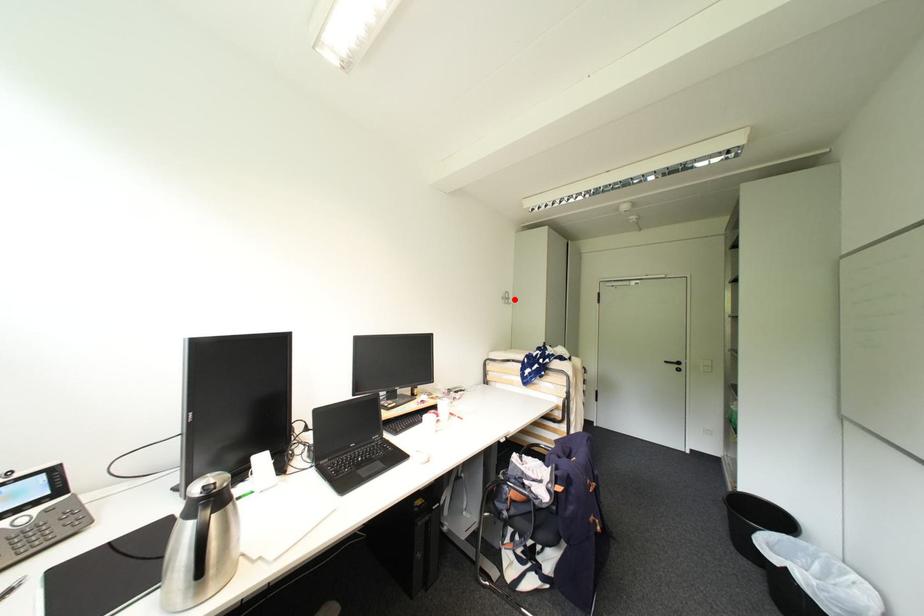
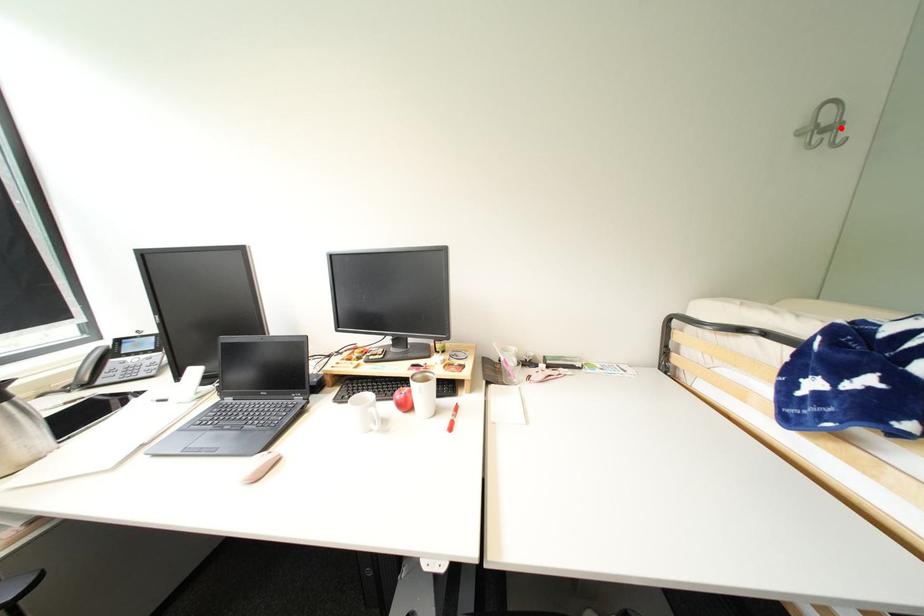
I am providing you with two images of the same scene from different viewpoints. A red point is marked on the first image and another point is marked on the second image. Is the red point in image1 aligned with the point shown in image2?

Yes